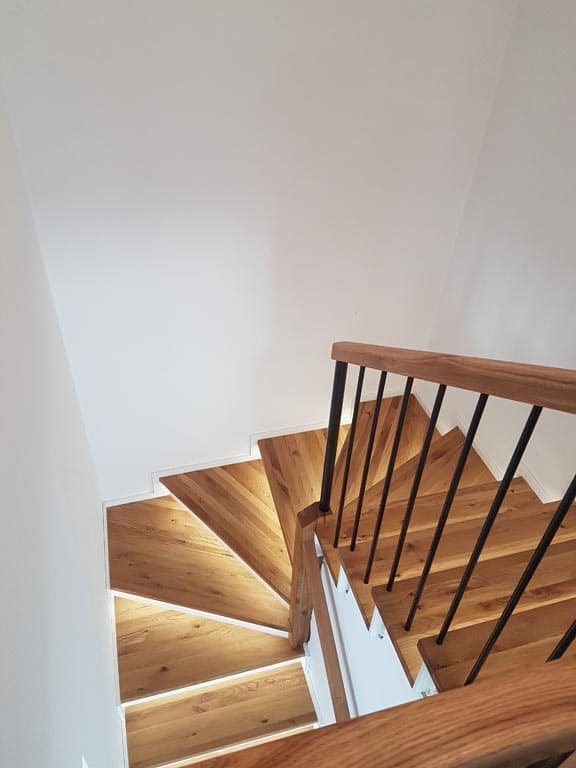
I want to click on white interior walls, so click(367, 659), click(314, 679), click(59, 545), click(192, 306), click(487, 292).